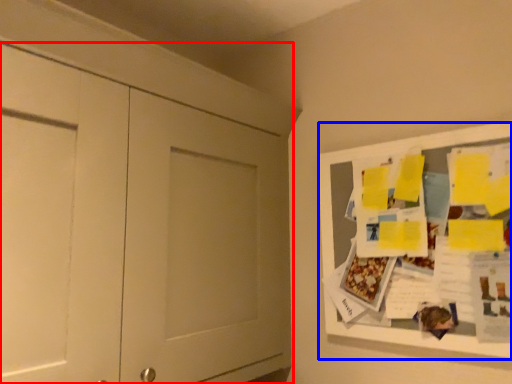
Question: Which object appears closest to the camera in this image, door (highlighted by a red box) or bulletin board (highlighted by a blue box)?

Choices:
 (A) door
 (B) bulletin board

Answer: (A)